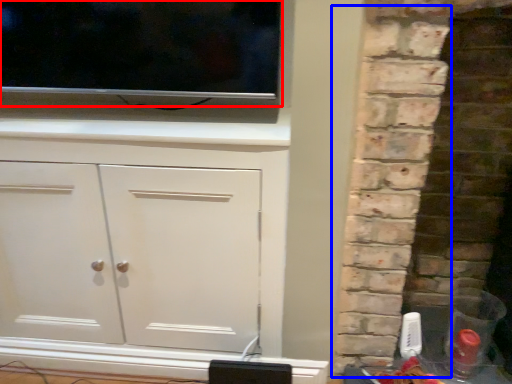
Question: Which object is closer to the camera taking this photo, tv show (highlighted by a red box) or brickwork (highlighted by a blue box)?

Choices:
 (A) tv show
 (B) brickwork

Answer: (B)